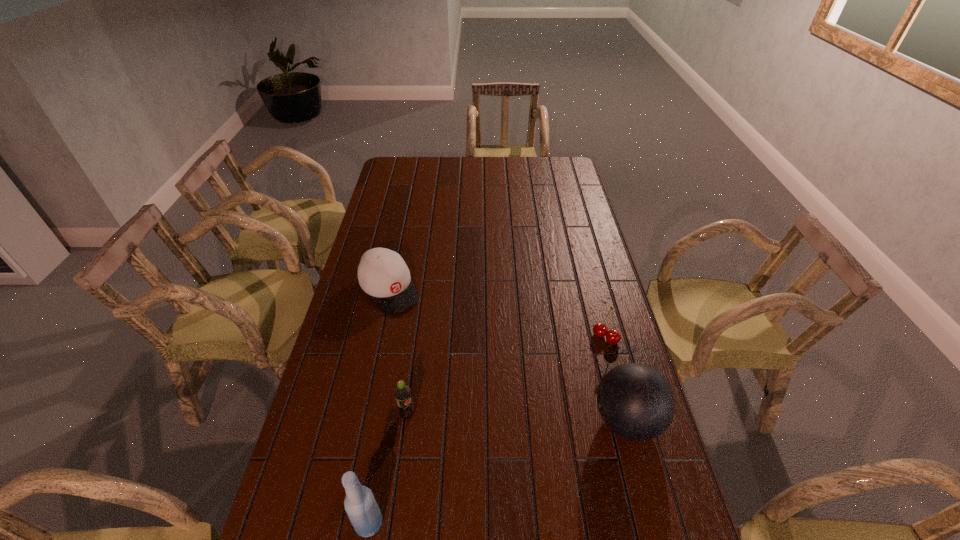
This screenshot has height=540, width=960. Find the location of `vacant space located on the front-facing side of the baseball cap`. vacant space located on the front-facing side of the baseball cap is located at coordinates (433, 347).

Where is `vacant space situated 0.370m on the front-facing side of the baseball cap`? The height and width of the screenshot is (540, 960). vacant space situated 0.370m on the front-facing side of the baseball cap is located at coordinates (465, 388).

At what (x,y) coordinates should I click in order to perform the action: click on free spot located on the front-facing side of the baseball cap. Please return your answer as a coordinate pair (x, y). The height and width of the screenshot is (540, 960). Looking at the image, I should click on (441, 357).

Find the location of a particular element. vacant space located with the stems of the cherry pointing upwards is located at coordinates (588, 362).

Find the location of a particular element. vacant space located 0.070m with the stems of the cherry pointing upwards is located at coordinates (588, 360).

You are a GUI agent. You are given a task and a screenshot of the screen. Output one action in this format:
    pyautogui.click(x=<x>, y=<y>)
    Task: Click on the free space located with the stems of the cherry pointing upwards
    Image resolution: width=960 pixels, height=540 pixels.
    Given the screenshot: What is the action you would take?
    pyautogui.click(x=571, y=384)

This screenshot has height=540, width=960. Find the location of `free space located on the front label of the soda`. free space located on the front label of the soda is located at coordinates (468, 467).

The image size is (960, 540). Identify the location of vacant point located on the front label of the soda. (434, 438).

This screenshot has height=540, width=960. What are the coordinates of `vacant space positioned on the front label of the soda` in the screenshot? It's located at (428, 434).

This screenshot has width=960, height=540. I want to click on object that is at the near edge, so click(360, 505).